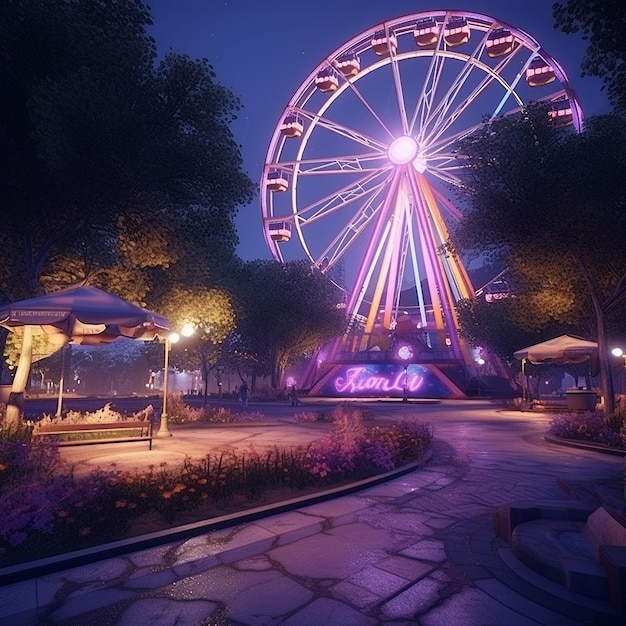
At what (x,y) coordinates should I click in order to perform the action: click on bench. Please return your answer as a coordinate pair (x, y). The image size is (626, 626). Looking at the image, I should click on (111, 426).